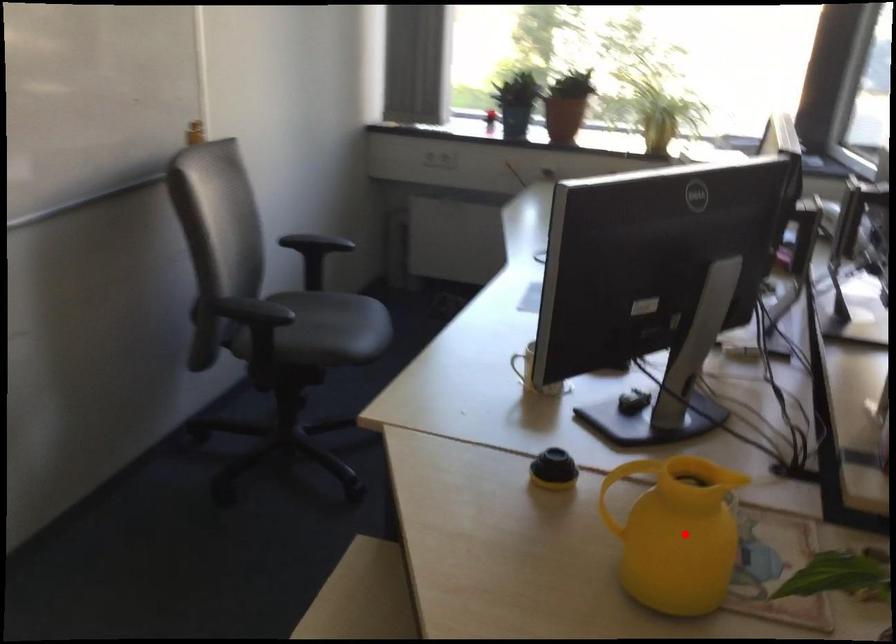
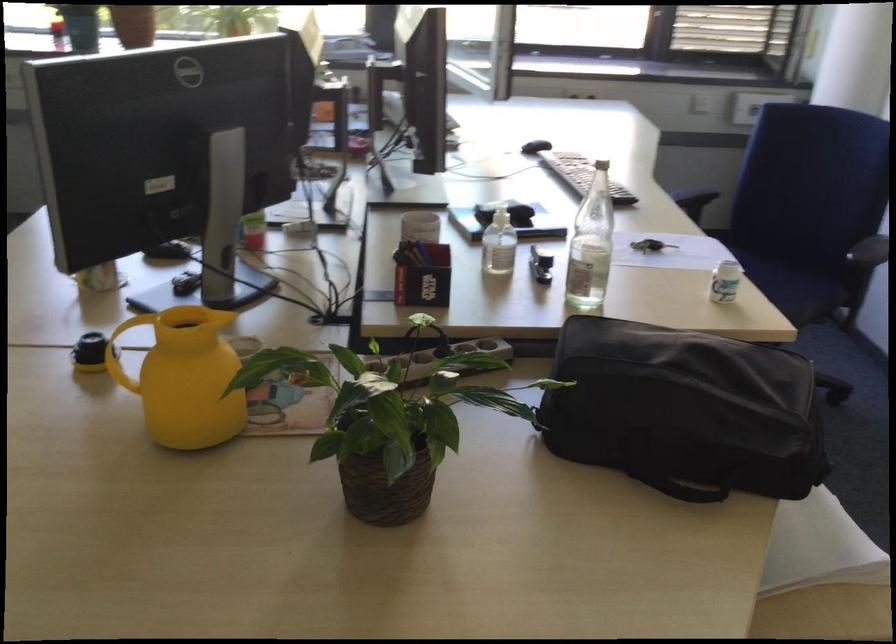
In the second image, find the point that corresponds to the highlighted location in the first image.

(185, 377)